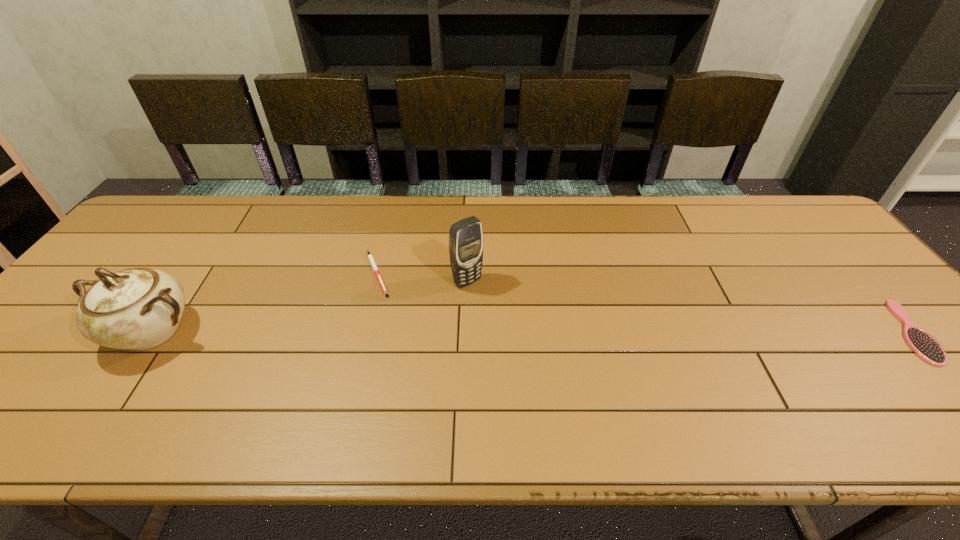
You are a GUI agent. You are given a task and a screenshot of the screen. Output one action in this format:
    pyautogui.click(x=<x>, y=<y>)
    Task: Click on the free point between the second object from left to right and the third object from left to right
    The width and height of the screenshot is (960, 540).
    Given the screenshot: What is the action you would take?
    pyautogui.click(x=422, y=278)

Where is `vacant space in between the pen and the second shortest object`? This screenshot has height=540, width=960. vacant space in between the pen and the second shortest object is located at coordinates (643, 302).

Identify the location of vacant area that lies between the hairbrush and the shortest object. Image resolution: width=960 pixels, height=540 pixels. (643, 302).

I want to click on vacant area that lies between the third tallest object and the pen, so click(643, 302).

Select which object appears as the third closest to the second object from left to right. Please provide its 2D coordinates. Your answer should be formatted as a tuple, i.e. [(x, y)], where the tuple contains the x and y coordinates of a point satisfying the conditions above.

[(926, 347)]

Where is `object that stands as the second closest to the pen`? object that stands as the second closest to the pen is located at coordinates pyautogui.click(x=139, y=308).